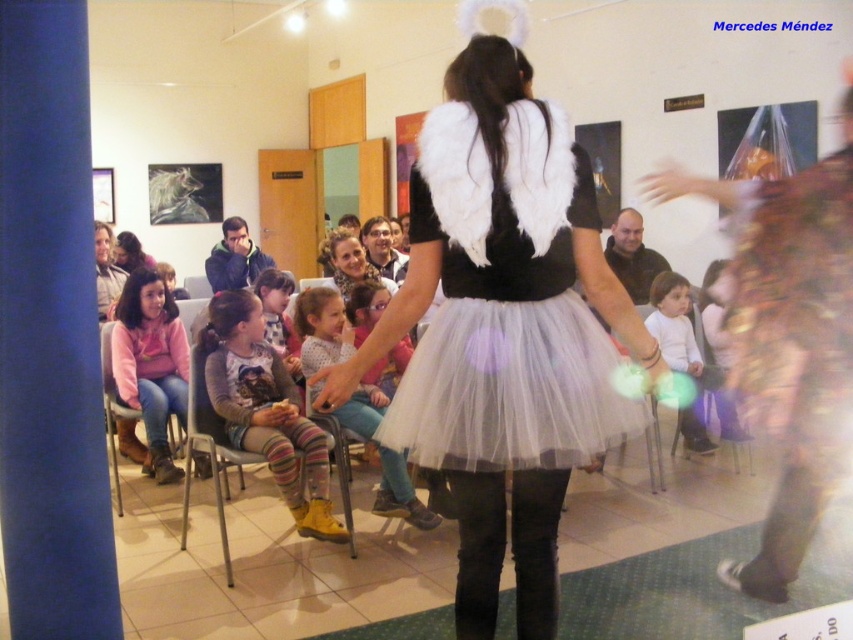
You are an event organizer who needs to arrange a photo shoot for the performers. You notice the pink fleece jacket at center and the yellow fabric pants at center. Which one should you focus on adjusting if you want to ensure the taller object is centered in the frame?

The pink fleece jacket at center is taller than the yellow fabric pants at center, so you should focus on adjusting the pink fleece jacket at center to ensure it is centered in the frame.

You are an event organizer standing at the front of the room. You need to place a microphone stand between yourself and the pink fleece jacket at center. Can you estimate if the microphone stand, which requires 10 feet of space to be placed safely, will fit in that area?

The distance between you and the pink fleece jacket at center is 12.38 feet, so yes, the microphone stand requiring 10 feet of space will fit in that area since there is enough space available.